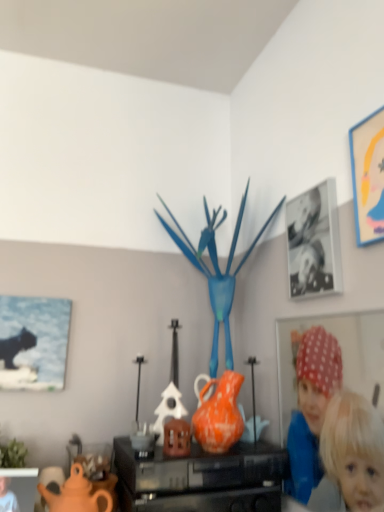
I want to click on vacant area situated to the left side of orange matte vase at center, so click(x=151, y=457).